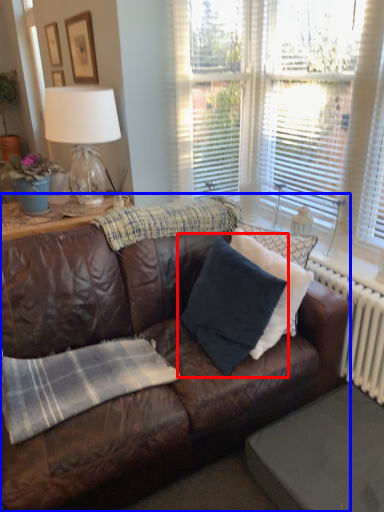
Question: Which point is closer to the camera, pillow (highlighted by a red box) or studio couch (highlighted by a blue box)?

Choices:
 (A) pillow
 (B) studio couch

Answer: (B)